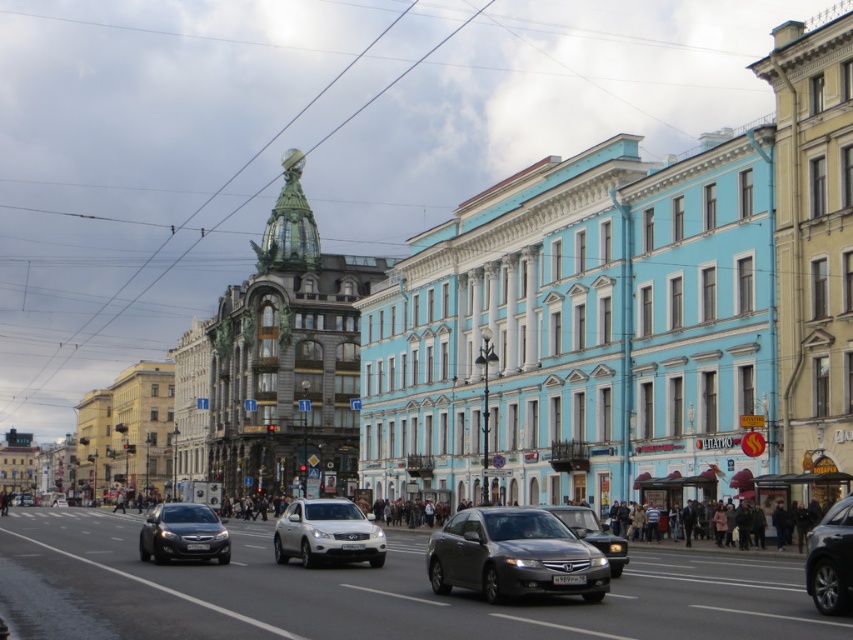
You are a delivery driver needing to park your 5.5 meter long truck between the shiny black sedan at center and the shiny black car at lower right. Can you fit your truck in the space between them without moving either vehicle?

The distance between the shiny black sedan at center and the shiny black car at lower right is 26.12 meters. Since your truck is only 5.5 meters long, there is more than enough space to park it between them without moving either vehicle.

You are standing at the intersection observing the street. Where is the shiny black sedan at center located in terms of coordinates?

The shiny black sedan at center is located at coordinates 0.834 on the x axis and 0.216 on the y axis.

You are standing on the sidewalk of this urban street and notice a point marked at coordinates [514,556]. Which object does this point belong to?

The point at coordinates [514,556] belongs to the metallic gray sedan at center.